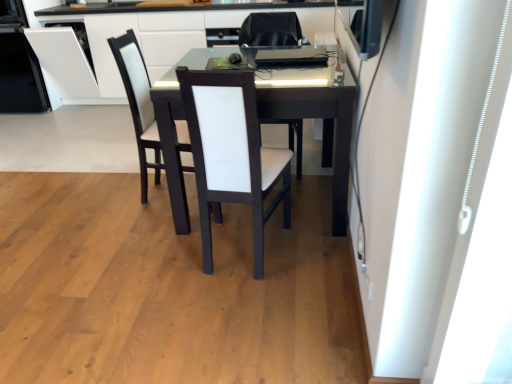
This screenshot has width=512, height=384. I want to click on free spot to the right of white leather chair at center, acting as the second chair starting from the back, so click(x=315, y=256).